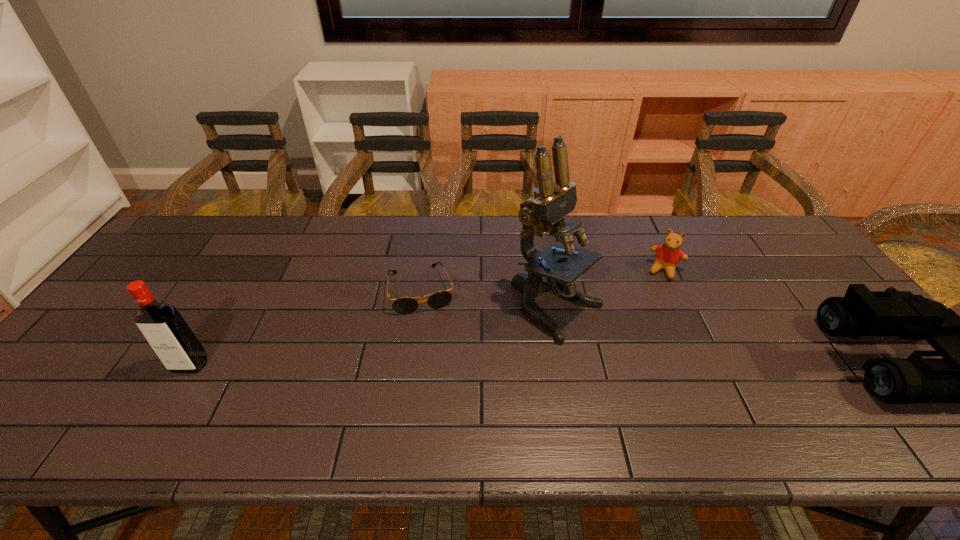
You are a GUI agent. You are given a task and a screenshot of the screen. Output one action in this format:
    pyautogui.click(x=<x>, y=<y>)
    Task: Click on the free space on the desktop that is between the vodka and the binoculars and is positioned on the front-facing side of the teddy bear
    This screenshot has width=960, height=540.
    Given the screenshot: What is the action you would take?
    tap(634, 361)

Locate an element on the screen. vacant spot on the desktop that is between the fourth shortest object and the rightmost object and is positioned on the front-facing side of the shortest object is located at coordinates (438, 363).

Locate an element on the screen. This screenshot has height=540, width=960. vacant space on the desktop that is between the second tallest object and the binoculars and is positioned at the eyepieces of the tallest object is located at coordinates (641, 361).